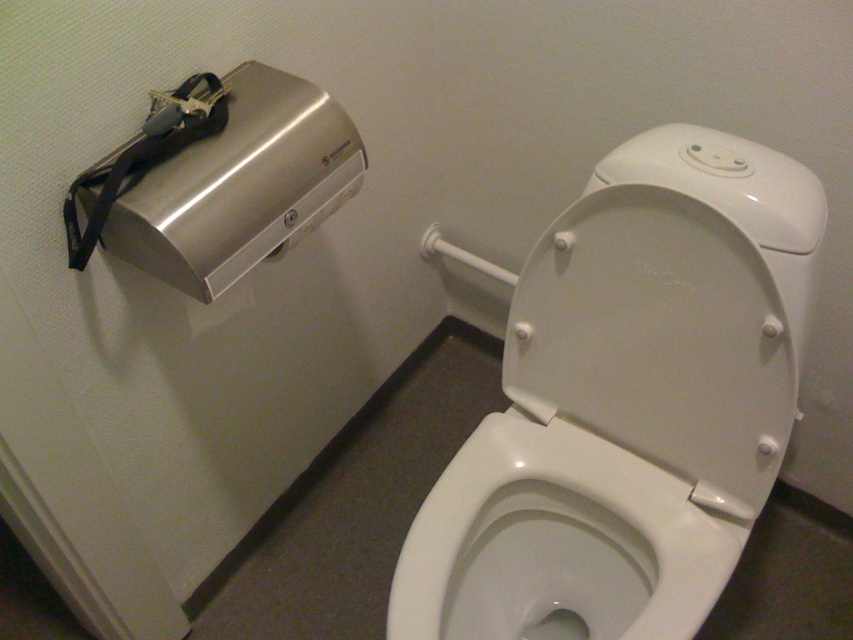
Question: Is white glossy toilet bowl at center closer to the viewer compared to satin silver hand dryer at upper left?

Choices:
 (A) yes
 (B) no

Answer: (B)

Question: Can you confirm if white glossy toilet bowl at center is smaller than satin silver hand dryer at upper left?

Choices:
 (A) no
 (B) yes

Answer: (A)

Question: Does white glossy toilet bowl at center have a larger size compared to satin silver hand dryer at upper left?

Choices:
 (A) yes
 (B) no

Answer: (A)

Question: Which point appears farthest from the camera in this image?

Choices:
 (A) (318, 220)
 (B) (618, 573)

Answer: (B)